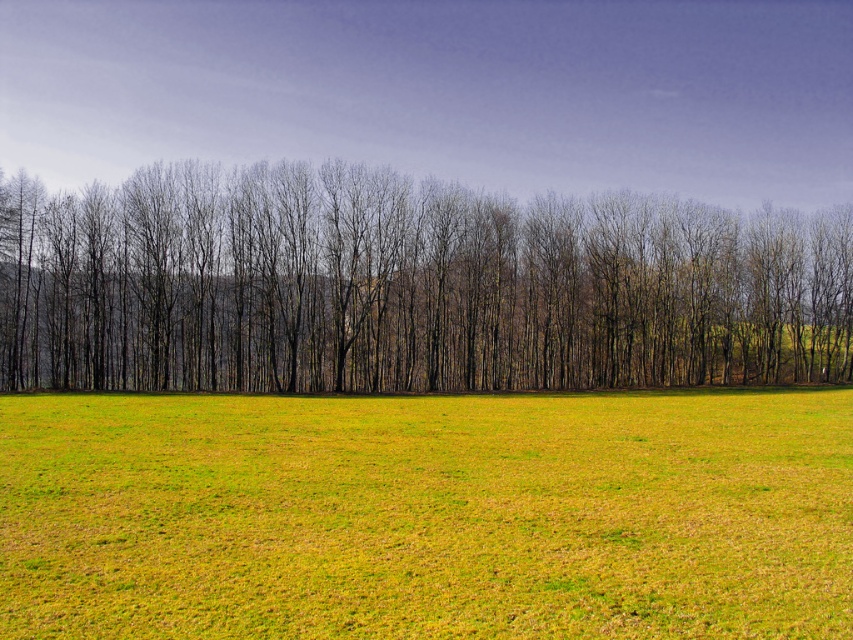
Question: Can you confirm if green grass at center is bigger than brown/dry wood trees at center?

Choices:
 (A) no
 (B) yes

Answer: (A)

Question: Can you confirm if green grass at center is wider than brown/dry wood trees at center?

Choices:
 (A) yes
 (B) no

Answer: (B)

Question: Is green grass at center to the right of brown/dry wood trees at center from the viewer's perspective?

Choices:
 (A) no
 (B) yes

Answer: (A)

Question: Which point appears closest to the camera in this image?

Choices:
 (A) (260, 564)
 (B) (808, 280)

Answer: (A)